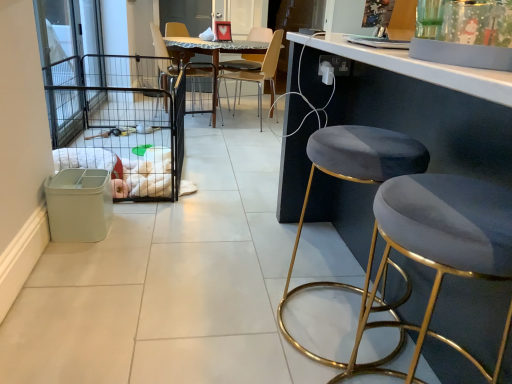
Question: Can wooden chair at center, which appears as the 2th chair when viewed from the left, be found inside black wire cage at left?

Choices:
 (A) yes
 (B) no

Answer: (B)

Question: Does black wire cage at left have a lesser width compared to wooden chair at center, which is counted as the 1th chair, starting from the right?

Choices:
 (A) yes
 (B) no

Answer: (B)

Question: Can you confirm if black wire cage at left is positioned to the left of wooden chair at center, which is counted as the 1th chair, starting from the right?

Choices:
 (A) no
 (B) yes

Answer: (B)

Question: Is black wire cage at left directly adjacent to wooden chair at center, which is counted as the 1th chair, starting from the right?

Choices:
 (A) no
 (B) yes

Answer: (A)

Question: Can you confirm if black wire cage at left is bigger than wooden chair at center, which appears as the 2th chair when viewed from the left?

Choices:
 (A) no
 (B) yes

Answer: (B)

Question: Which is correct: clear glass screen door at left is inside black wire cage at left, or outside of it?

Choices:
 (A) inside
 (B) outside

Answer: (B)

Question: In the image, is clear glass screen door at left positioned in front of or behind black wire cage at left?

Choices:
 (A) behind
 (B) front

Answer: (A)

Question: From their relative heights in the image, would you say clear glass screen door at left is taller or shorter than black wire cage at left?

Choices:
 (A) short
 (B) tall

Answer: (B)

Question: From a real-world perspective, is clear glass screen door at left physically located above or below black wire cage at left?

Choices:
 (A) above
 (B) below

Answer: (A)

Question: Considering the positions of velvet/golden stool at right, the 1th stool in the back-to-front sequence, and velvet/golden stool at right, the 1th stool in the front-to-back sequence, in the image, is velvet/golden stool at right, the 1th stool in the back-to-front sequence, wider or thinner than velvet/golden stool at right, the 1th stool in the front-to-back sequence,?

Choices:
 (A) wide
 (B) thin

Answer: (B)

Question: Considering the positions of velvet/golden stool at right, the 1th stool in the back-to-front sequence, and velvet/golden stool at right, the second stool positioned from the back, in the image, is velvet/golden stool at right, the 1th stool in the back-to-front sequence, taller or shorter than velvet/golden stool at right, the second stool positioned from the back,?

Choices:
 (A) short
 (B) tall

Answer: (A)

Question: Is velvet/golden stool at right, positioned as the second stool in front-to-back order, situated inside velvet/golden stool at right, the second stool positioned from the back, or outside?

Choices:
 (A) outside
 (B) inside

Answer: (A)

Question: Considering their positions, is velvet/golden stool at right, the 1th stool in the back-to-front sequence, located in front of or behind velvet/golden stool at right, the second stool positioned from the back?

Choices:
 (A) front
 (B) behind

Answer: (B)

Question: Would you say wooden chair at center, which appears as the 2th chair when viewed from the left, is to the left or to the right of velvet/golden stool at right, the second stool positioned from the back, in the picture?

Choices:
 (A) right
 (B) left

Answer: (B)

Question: Is wooden chair at center, which appears as the 2th chair when viewed from the left, wider or thinner than velvet/golden stool at right, the 1th stool in the front-to-back sequence?

Choices:
 (A) thin
 (B) wide

Answer: (B)